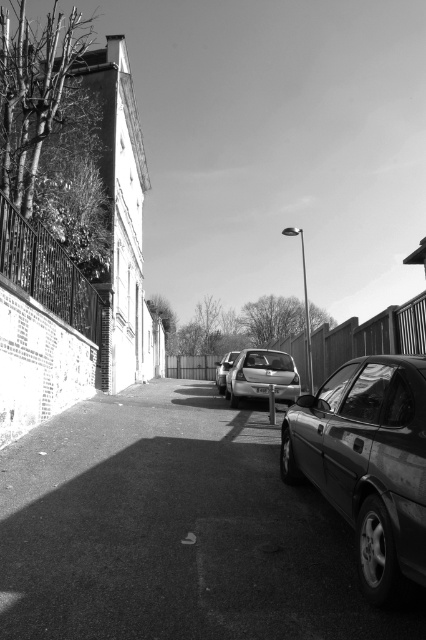
You are a pedestrian standing at the intersection and want to cross the street to the building with the sloped roof. There are two cars in your path. The shiny metallic car at right and the silver metallic car at center. Which car is closer to you as you stand at the intersection?

The shiny metallic car at right is closer to you since it is in front of the silver metallic car at center.

You are standing at the camera position looking down the street. There are two points marked on the image, one at coordinates point [342,417] and the other at point [218,376]. Which point is closer to you?

Point [342,417] is closer to the camera than point [218,376].